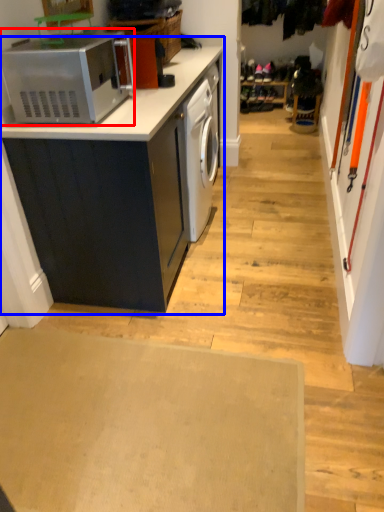
Question: Which object is further to the camera taking this photo, home appliance (highlighted by a red box) or cabinetry (highlighted by a blue box)?

Choices:
 (A) home appliance
 (B) cabinetry

Answer: (B)